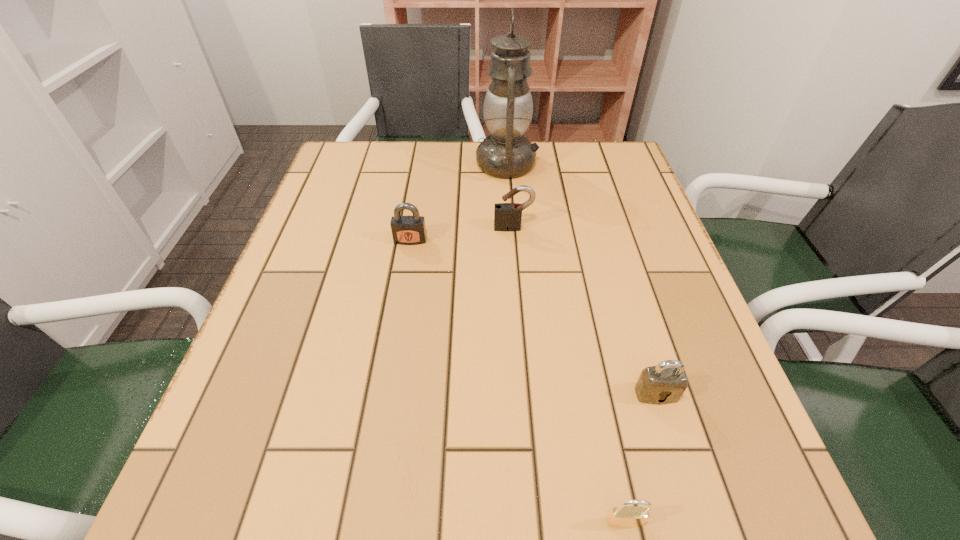
Where is `vacant space positioned 0.390m on the left of the oil lamp`? vacant space positioned 0.390m on the left of the oil lamp is located at coordinates (337, 164).

Where is `vacant space located 0.210m with the keyhole on the front of the third padlock from right to left`? vacant space located 0.210m with the keyhole on the front of the third padlock from right to left is located at coordinates (519, 299).

Locate an element on the screen. vacant area situated on the front of the second farthest padlock near the keyhole is located at coordinates (395, 335).

Where is `free space located at the front of the rightmost padlock near the keyhole`? This screenshot has height=540, width=960. free space located at the front of the rightmost padlock near the keyhole is located at coordinates (677, 460).

Locate an element on the screen. The height and width of the screenshot is (540, 960). object positioned at the far edge is located at coordinates click(x=508, y=106).

Find the location of `object that is at the near edge`. object that is at the near edge is located at coordinates (623, 516).

Locate an element on the screen. The image size is (960, 540). object at the right edge is located at coordinates (665, 383).

You are a GUI agent. You are given a task and a screenshot of the screen. Output one action in this format:
    pyautogui.click(x=<x>, y=<y>)
    Task: Click on the free space at the far edge of the desktop
    This screenshot has height=540, width=960.
    Given the screenshot: What is the action you would take?
    (555, 142)

In the image, there is a desktop. Where is `free space at the near edge`? This screenshot has width=960, height=540. free space at the near edge is located at coordinates (652, 464).

In the image, there is a desktop. Where is `vacant area at the left edge`? vacant area at the left edge is located at coordinates (326, 260).